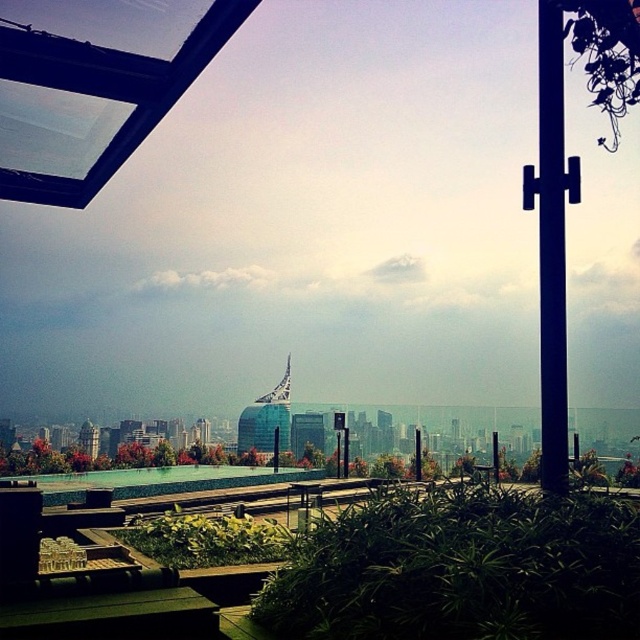
Question: Which object appears farthest from the camera in this image?

Choices:
 (A) black metal pole at center
 (B) black metal pole at right

Answer: (A)

Question: Does black metal pole at right have a greater width compared to black metal pole at center?

Choices:
 (A) no
 (B) yes

Answer: (B)

Question: Does black metal pole at right appear on the left side of black metal pole at center?

Choices:
 (A) yes
 (B) no

Answer: (B)

Question: In this image, where is black metal pole at right located relative to black metal pole at center?

Choices:
 (A) right
 (B) left

Answer: (A)

Question: Which object is farther from the camera taking this photo?

Choices:
 (A) black metal pole at center
 (B) black metal pole at right

Answer: (A)